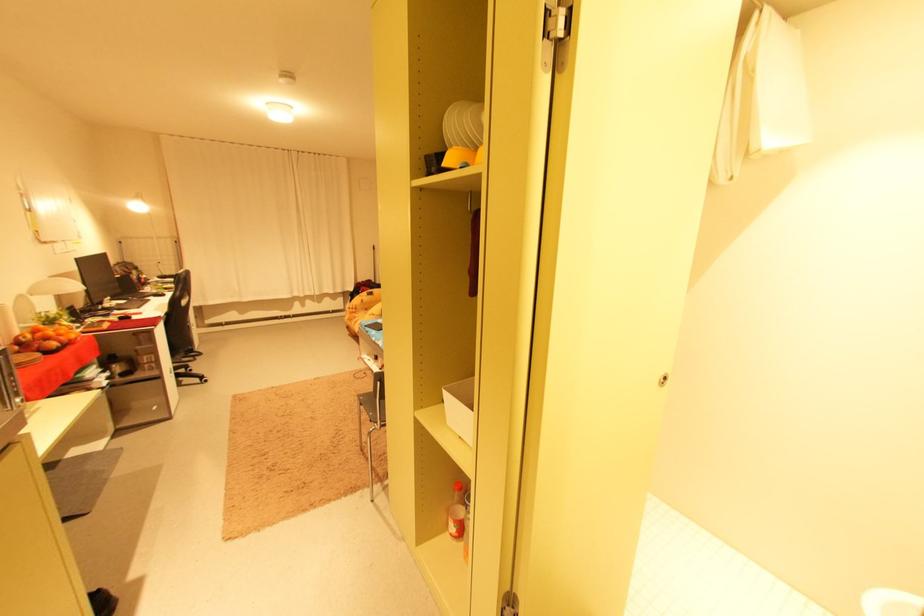
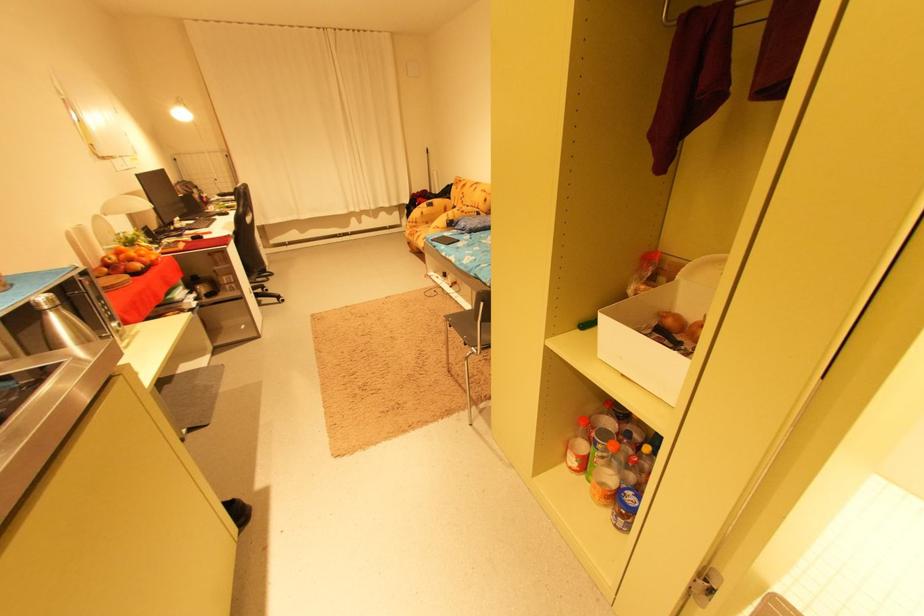
Where in the second image is the point corresponding to pixel 455 536 from the first image?

(572, 467)